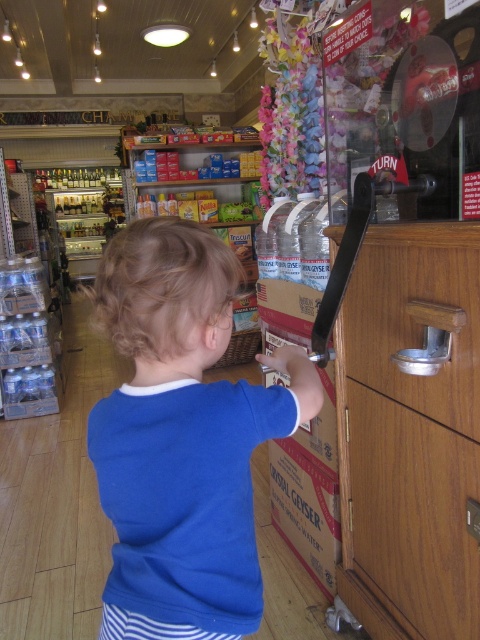
Question: Which of the following is the closest to the observer?

Choices:
 (A) (455, 426)
 (B) (244, 502)

Answer: (B)

Question: Can you confirm if wooden drawer at center is wider than wooden at right?

Choices:
 (A) yes
 (B) no

Answer: (B)

Question: Which object appears farthest from the camera in this image?

Choices:
 (A) blue cotton shirt at center
 (B) wooden at right
 (C) wooden drawer at center

Answer: (C)

Question: Is blue cotton shirt at center behind wooden drawer at center?

Choices:
 (A) no
 (B) yes

Answer: (A)

Question: Estimate the real-world distances between objects in this image. Which object is closer to the wooden at right?

Choices:
 (A) wooden drawer at center
 (B) blue cotton shirt at center

Answer: (A)

Question: Can you confirm if blue cotton shirt at center is thinner than wooden at right?

Choices:
 (A) yes
 (B) no

Answer: (B)